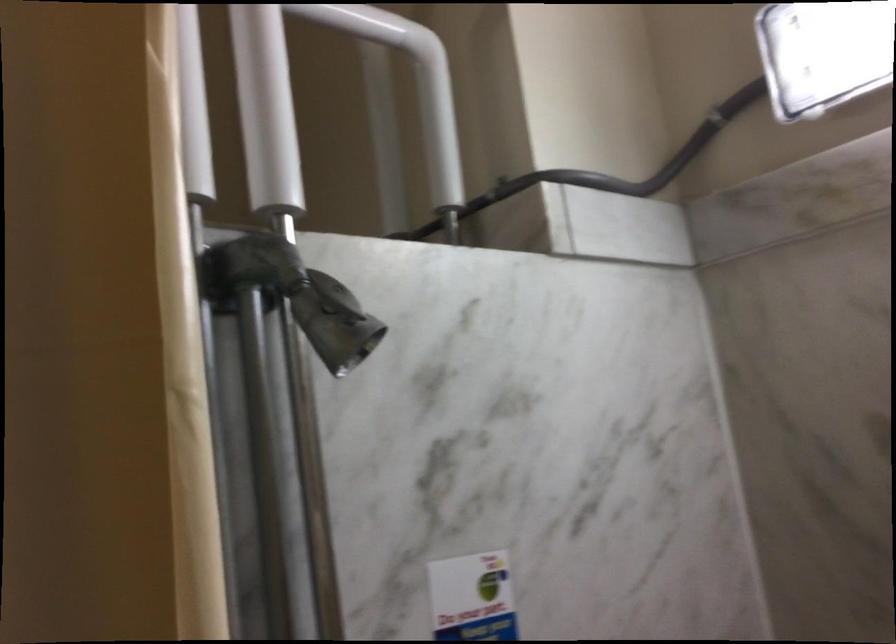
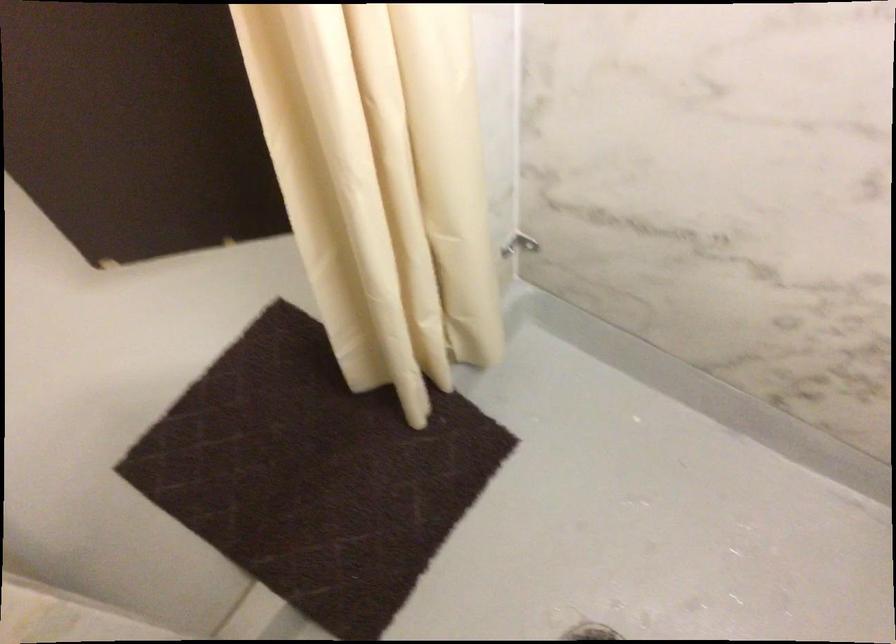
In the scene shown: Based on the continuous images, in which direction is the camera rotating?

The camera's rotation is toward right-down.